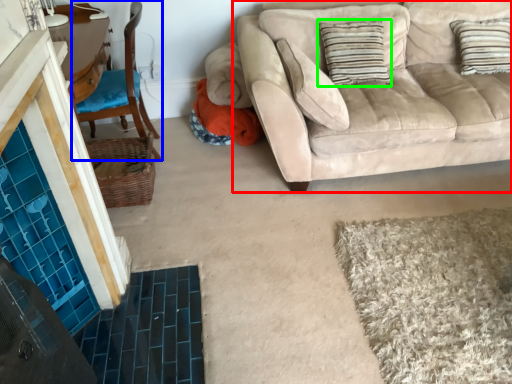
Question: Which object is the farthest from studio couch (highlighted by a red box)? Choose among these: chair (highlighted by a blue box) or pillow (highlighted by a green box).

Choices:
 (A) chair
 (B) pillow

Answer: (A)